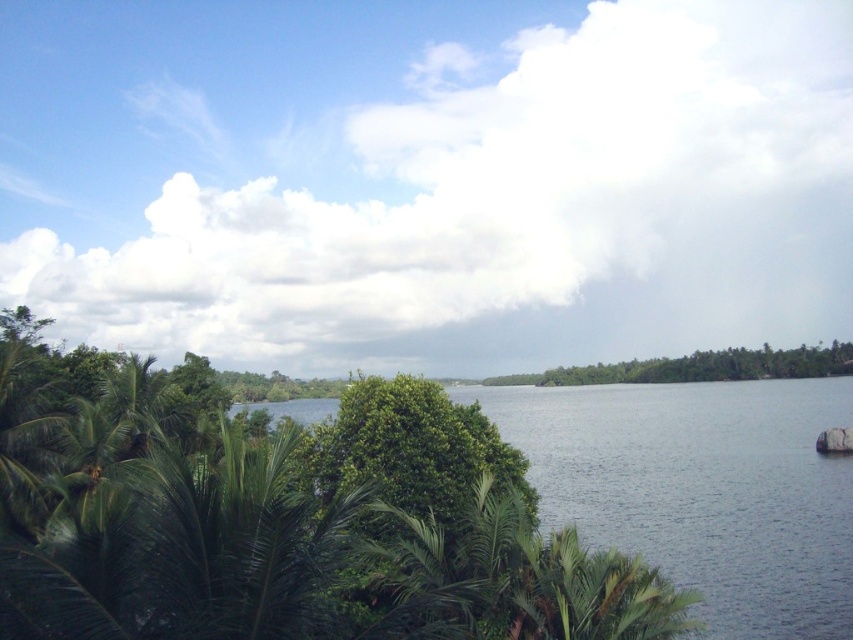
Question: Can you confirm if dark blue water at center is positioned to the left of green leafy tree at center?

Choices:
 (A) yes
 (B) no

Answer: (B)

Question: Does dark blue water at center appear on the right side of green leafy tree at center?

Choices:
 (A) yes
 (B) no

Answer: (A)

Question: Observing the image, what is the correct spatial positioning of green leafy tree at center in reference to green leafy trees at center?

Choices:
 (A) below
 (B) above

Answer: (B)

Question: Which of the following is the farthest from the observer?

Choices:
 (A) dark blue water at center
 (B) green leafy tree at center

Answer: (A)

Question: Which point is closer to the camera taking this photo?

Choices:
 (A) (844, 355)
 (B) (497, 486)

Answer: (B)

Question: Which object appears farthest from the camera in this image?

Choices:
 (A) green leafy tree at center
 (B) green leafy trees at center

Answer: (B)